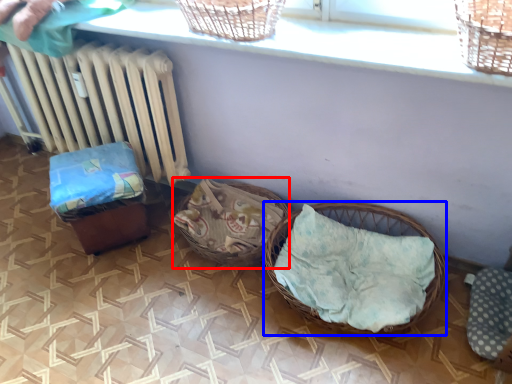
Question: Which point is further to the camera, basket (highlighted by a red box) or picnic basket (highlighted by a blue box)?

Choices:
 (A) basket
 (B) picnic basket

Answer: (A)